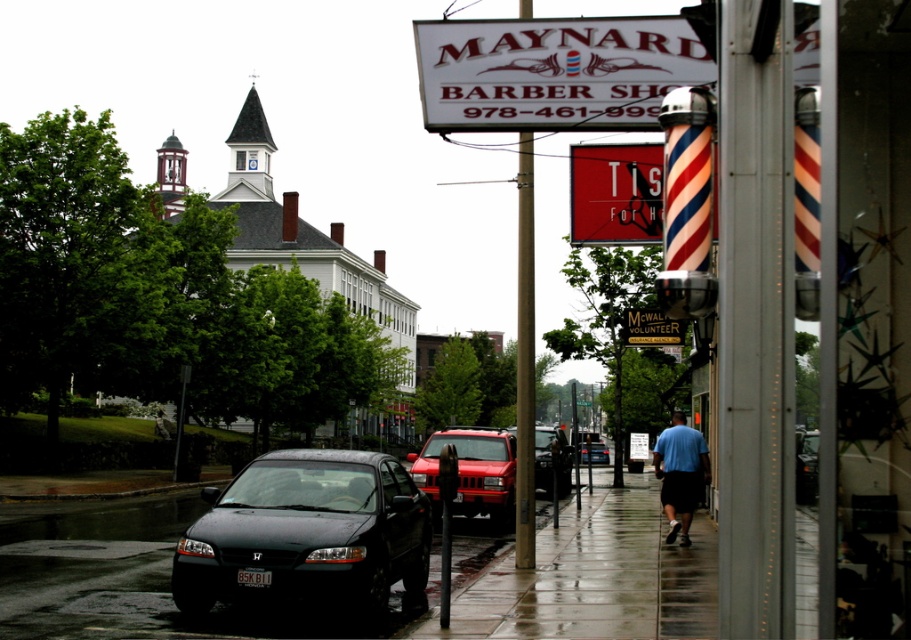
Question: Which point is farther to the camera?

Choices:
 (A) (589, 449)
 (B) (543, 44)

Answer: (A)

Question: Which object is farther from the camera taking this photo?

Choices:
 (A) matte red barber pole at upper center
 (B) matte black suv at center

Answer: (B)

Question: Is matte black sedan at lower left bigger than matte black suv at center?

Choices:
 (A) no
 (B) yes

Answer: (A)

Question: Is shiny red suv at center further to camera compared to matte black suv at center?

Choices:
 (A) no
 (B) yes

Answer: (A)

Question: Considering the real-world distances, which object is farthest from the white plastic sign at upper center?

Choices:
 (A) light blue shirt at center
 (B) shiny red suv at center
 (C) matte black sedan at lower left
 (D) matte black suv at center

Answer: (D)

Question: Is matte red barber pole at upper center smaller than light blue shirt at center?

Choices:
 (A) no
 (B) yes

Answer: (B)